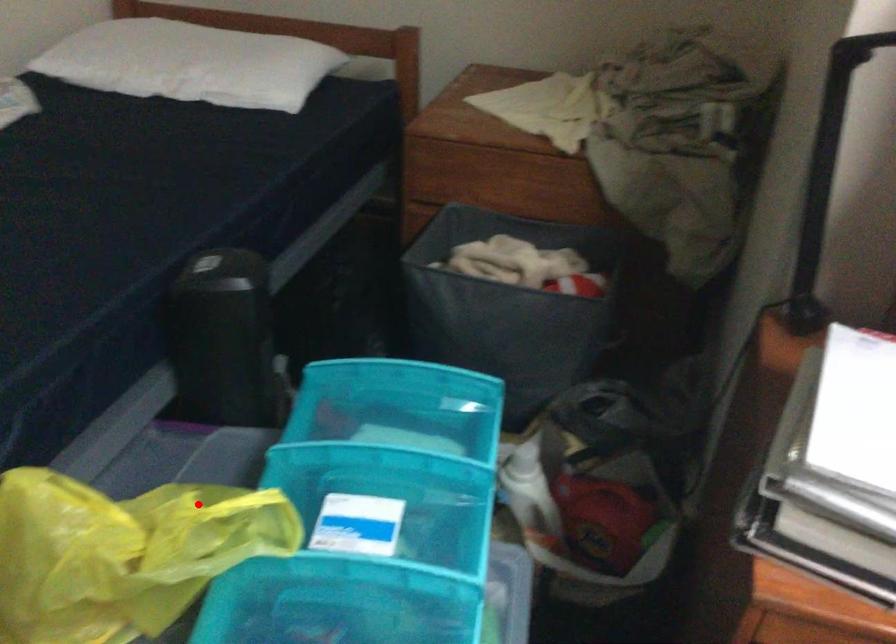
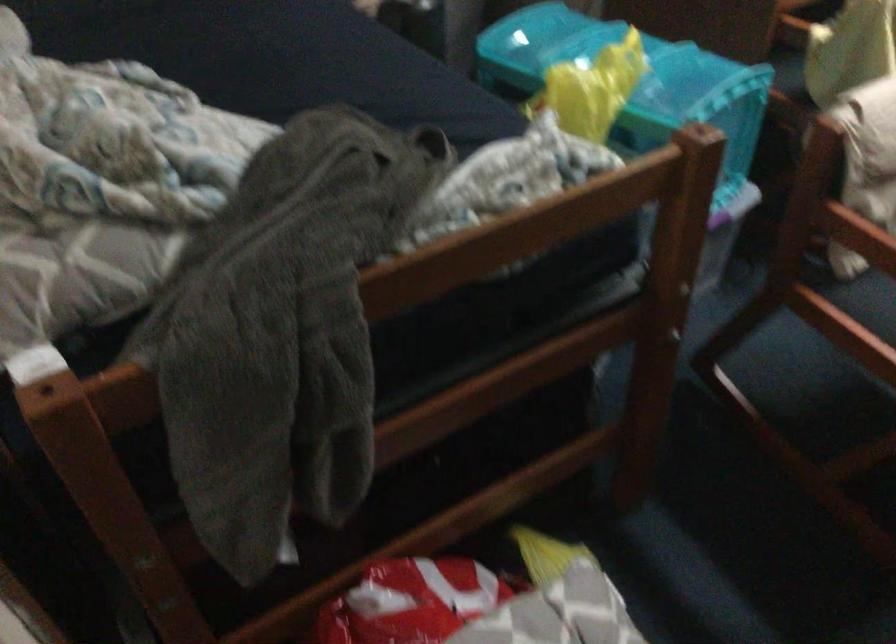
Question: I am providing you with two images of the same scene from different viewpoints. In image1, a red point is highlighted. Considering the same 3D point in image2, which of the following is correct?

Choices:
 (A) It is closer
 (B) It is farther

Answer: (B)